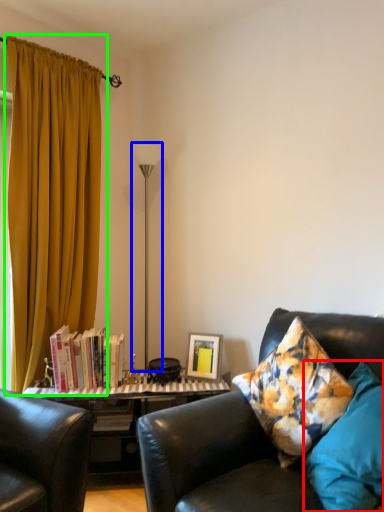
Question: Estimate the real-world distances between objects in this image. Which object is closer to pillow (highlighted by a red box), lamp (highlighted by a blue box) or curtain (highlighted by a green box)?

Choices:
 (A) lamp
 (B) curtain

Answer: (B)